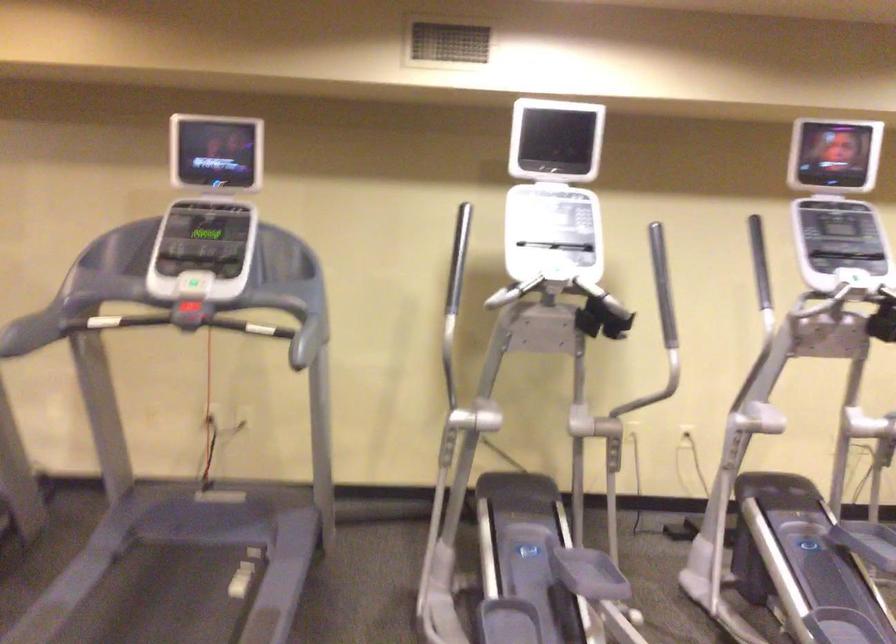
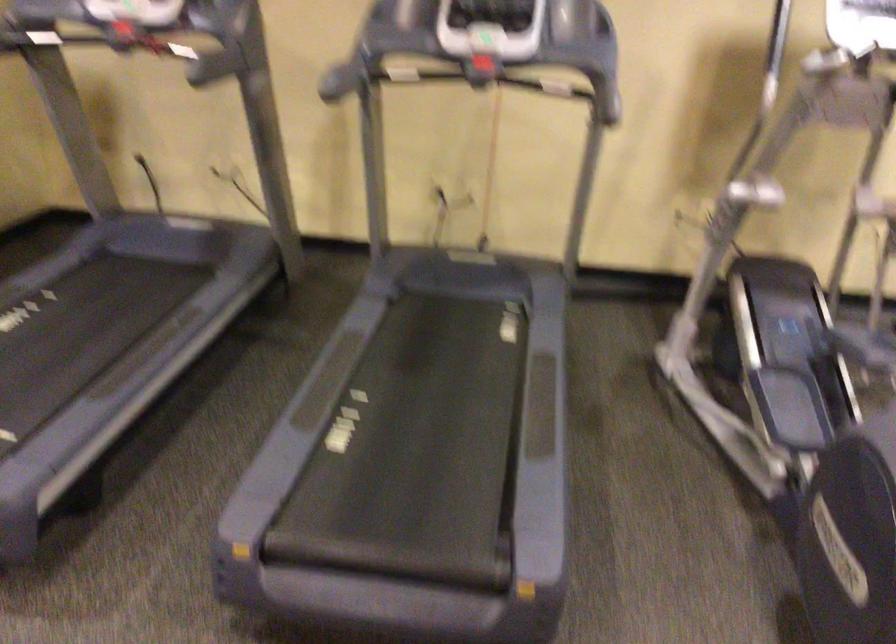
Question: The images are taken continuously from a first-person perspective. In which direction is your viewpoint rotating?

Choices:
 (A) Left
 (B) Right
 (C) Up
 (D) Down

Answer: (D)